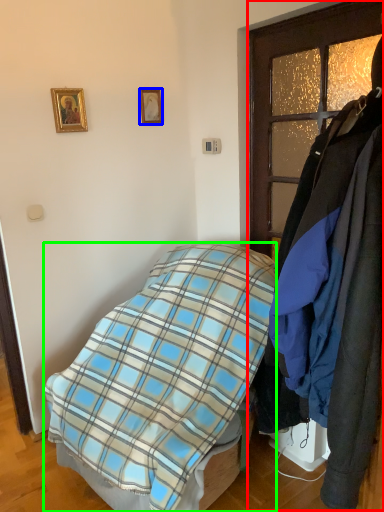
Question: Based on their relative distances, which object is nearer to closet (highlighted by a red box)? Choose from picture frame (highlighted by a blue box) and bed (highlighted by a green box).

Choices:
 (A) picture frame
 (B) bed

Answer: (A)